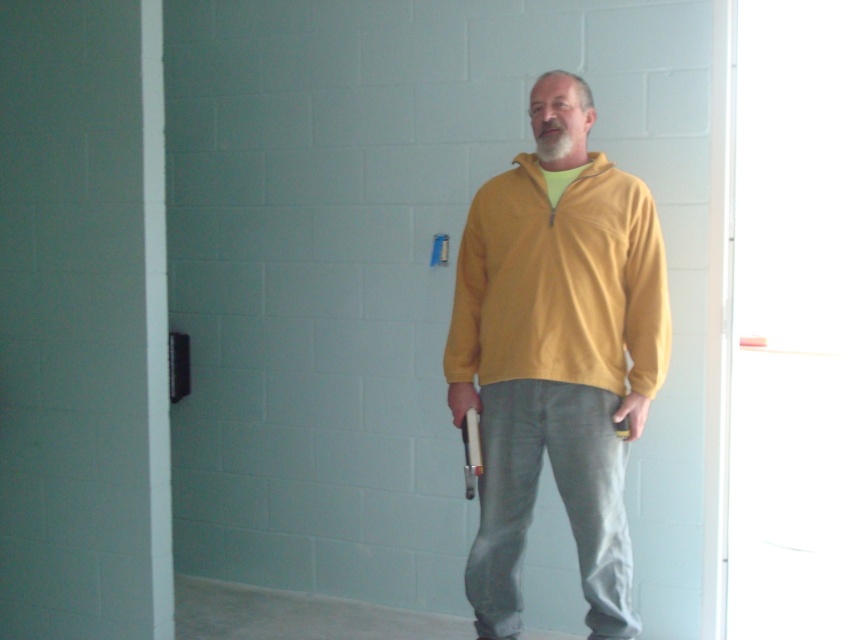
Question: Does yellow fleece jacket at center have a smaller size compared to yellow fleece sweatshirt at center?

Choices:
 (A) yes
 (B) no

Answer: (B)

Question: Is yellow fleece jacket at center thinner than yellow fleece sweatshirt at center?

Choices:
 (A) no
 (B) yes

Answer: (B)

Question: Which of the following is the closest to the observer?

Choices:
 (A) yellow fleece jacket at center
 (B) yellow fleece sweatshirt at center

Answer: (A)

Question: Does yellow fleece jacket at center have a smaller size compared to yellow fleece sweatshirt at center?

Choices:
 (A) no
 (B) yes

Answer: (A)